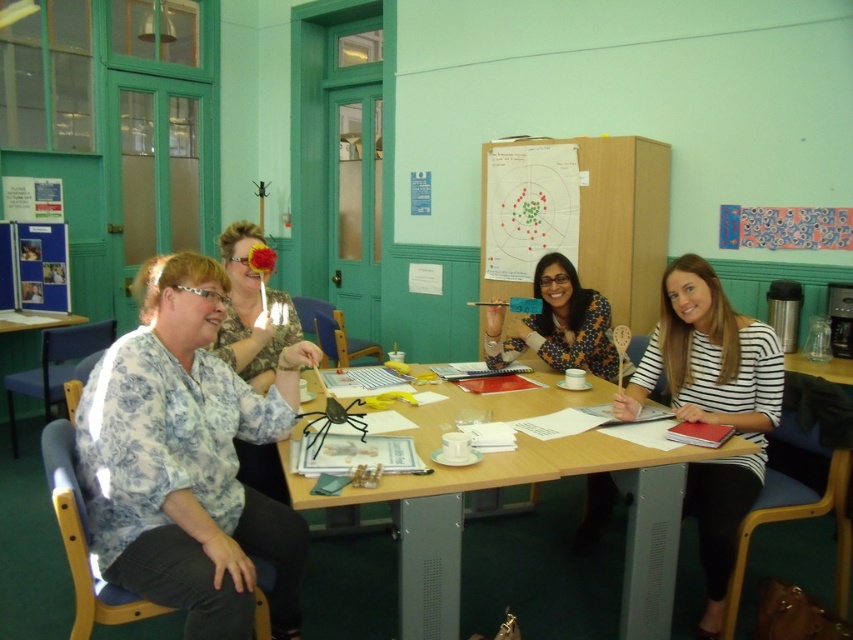
Question: Is printed fabric blouse at center behind floral blouse at left?

Choices:
 (A) no
 (B) yes

Answer: (B)

Question: Which of the following is the closest to the observer?

Choices:
 (A) floral blouse at left
 (B) wooden table at center
 (C) white striped shirt at right

Answer: (B)

Question: Estimate the real-world distances between objects in this image. Which object is farther from the white striped shirt at right?

Choices:
 (A) floral blouse at left
 (B) printed fabric blouse at center

Answer: (A)

Question: Can you confirm if white striped shirt at right is thinner than floral blouse at left?

Choices:
 (A) no
 (B) yes

Answer: (A)

Question: Is wooden table at center further to camera compared to floral blouse at left?

Choices:
 (A) no
 (B) yes

Answer: (A)

Question: Which of the following is the closest to the observer?

Choices:
 (A) printed fabric blouse at center
 (B) white striped shirt at right

Answer: (B)